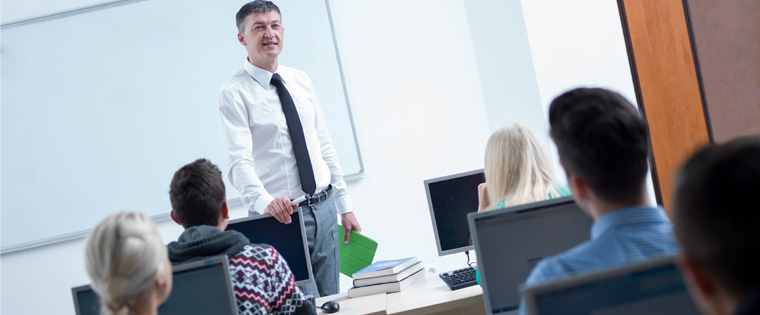
Where is `computer screens`? The width and height of the screenshot is (760, 315). computer screens is located at coordinates (280, 234), (211, 289), (456, 216), (501, 241).